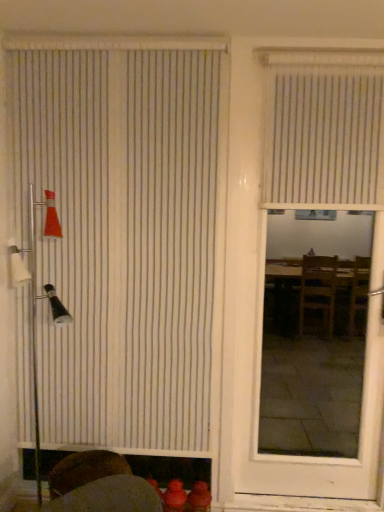
Question: Does white vertical blinds at upper right, arranged as the first window blind when viewed from the right, have a lesser width compared to white vertical blinds at left, the 2th window blind positioned from the right?

Choices:
 (A) yes
 (B) no

Answer: (B)

Question: Is the depth of white vertical blinds at upper right, the 2th window blind positioned from the left, less than that of white vertical blinds at left, which ranks as the first window blind in left-to-right order?

Choices:
 (A) no
 (B) yes

Answer: (B)

Question: Is white vertical blinds at upper right, arranged as the first window blind when viewed from the right, shorter than white vertical blinds at left, the 2th window blind positioned from the right?

Choices:
 (A) no
 (B) yes

Answer: (B)

Question: Is the depth of white vertical blinds at upper right, arranged as the first window blind when viewed from the right, greater than that of white vertical blinds at left, the 2th window blind positioned from the right?

Choices:
 (A) no
 (B) yes

Answer: (A)

Question: From the image's perspective, is white vertical blinds at upper right, the 2th window blind positioned from the left, above white vertical blinds at left, the 2th window blind positioned from the right?

Choices:
 (A) no
 (B) yes

Answer: (B)

Question: In terms of size, does white matte door at center appear bigger or smaller than white vertical blinds at upper right, arranged as the first window blind when viewed from the right?

Choices:
 (A) big
 (B) small

Answer: (A)

Question: Considering the positions of white matte door at center and white vertical blinds at upper right, the 2th window blind positioned from the left, in the image, is white matte door at center taller or shorter than white vertical blinds at upper right, the 2th window blind positioned from the left,?

Choices:
 (A) tall
 (B) short

Answer: (A)

Question: Is white matte door at center situated inside white vertical blinds at upper right, arranged as the first window blind when viewed from the right, or outside?

Choices:
 (A) inside
 (B) outside

Answer: (B)

Question: Is white matte door at center wider or thinner than white vertical blinds at upper right, arranged as the first window blind when viewed from the right?

Choices:
 (A) wide
 (B) thin

Answer: (A)

Question: In terms of width, does white vertical blinds at left, the 2th window blind positioned from the right, look wider or thinner when compared to white matte door at center?

Choices:
 (A) wide
 (B) thin

Answer: (B)

Question: Is white vertical blinds at left, the 2th window blind positioned from the right, in front of or behind white matte door at center in the image?

Choices:
 (A) front
 (B) behind

Answer: (B)

Question: Is point (170, 385) positioned closer to the camera than point (362, 449)?

Choices:
 (A) closer
 (B) farther

Answer: (A)

Question: Would you say white vertical blinds at left, the 2th window blind positioned from the right, is inside or outside white matte door at center?

Choices:
 (A) inside
 (B) outside

Answer: (B)

Question: Considering their positions, is white vertical blinds at left, the 2th window blind positioned from the right, located in front of or behind white vertical blinds at upper right, the 2th window blind positioned from the left?

Choices:
 (A) behind
 (B) front

Answer: (A)

Question: Looking at their shapes, would you say white vertical blinds at left, which ranks as the first window blind in left-to-right order, is wider or thinner than white vertical blinds at upper right, the 2th window blind positioned from the left?

Choices:
 (A) wide
 (B) thin

Answer: (B)